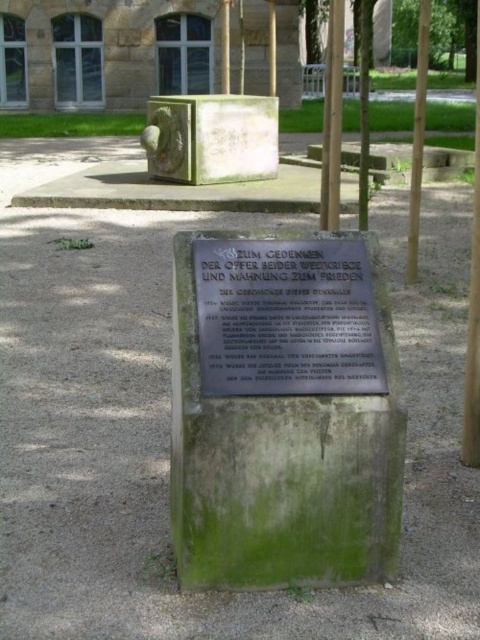
Question: Does bronze plaque at center have a greater width compared to green stone safe at upper center?

Choices:
 (A) yes
 (B) no

Answer: (B)

Question: Which point appears farthest from the camera in this image?

Choices:
 (A) (421, 164)
 (B) (267, 497)
 (C) (296, 316)

Answer: (A)

Question: Does green stone safe at upper center have a lesser width compared to green wood pole at right?

Choices:
 (A) no
 (B) yes

Answer: (B)

Question: Which is farther from the brown wooden pole at center?

Choices:
 (A) green stone safe at upper center
 (B) green wood pole at right
 (C) bronze plaque at center

Answer: (A)

Question: Which object appears farthest from the camera in this image?

Choices:
 (A) green mossy stone plaque at center
 (B) green wooden pole at upper center
 (C) green stone pole at center

Answer: (C)

Question: Is brown wooden pole at center thinner than green stone pole at center?

Choices:
 (A) yes
 (B) no

Answer: (B)